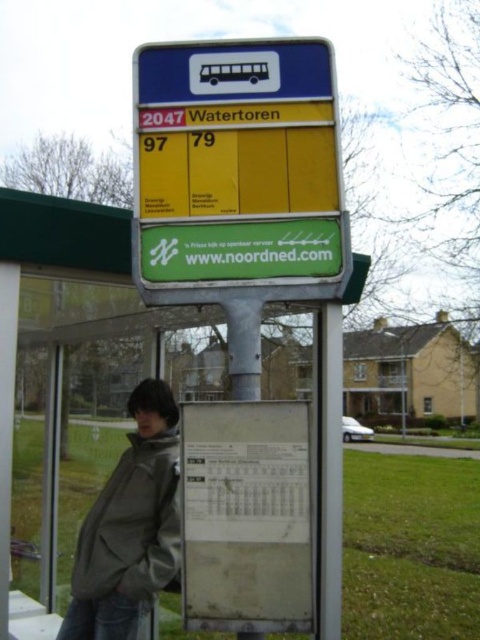
You are a pedestrian standing at the bus stop and need to check the route numbers on the metallic green sign at center. However, there is a gray matte jacket at lower left hanging from the pole. Is the jacket blocking your view of the sign?

The metallic green sign at center is positioned on the left side of the gray matte jacket at lower left, so the jacket is to the right of the sign. Since the jacket is on the left side of the sign, it would not block your view of the sign from the front.

You are standing at the bus stop and need to check the route numbers on the metallic green sign at center. However, there is a gray matte jacket at lower left partially blocking your view. Is the jacket in a position that would make it hard to see the route numbers on the sign?

The metallic green sign at center is positioned over the gray matte jacket at lower left, so the jacket is below the sign and might block the lower part of the sign. The route numbers 97 and 79 are on the yellow background below the blue section, so if the jacket is covering the lower part, it might be difficult to see the route numbers.